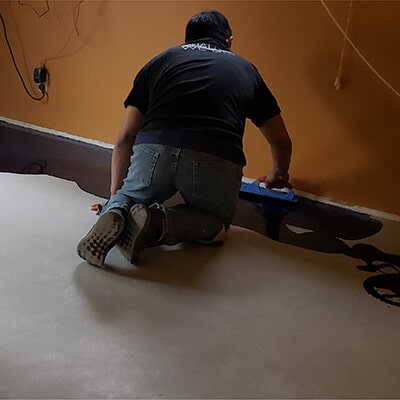
Find the location of `white cord`. white cord is located at coordinates (348, 41).